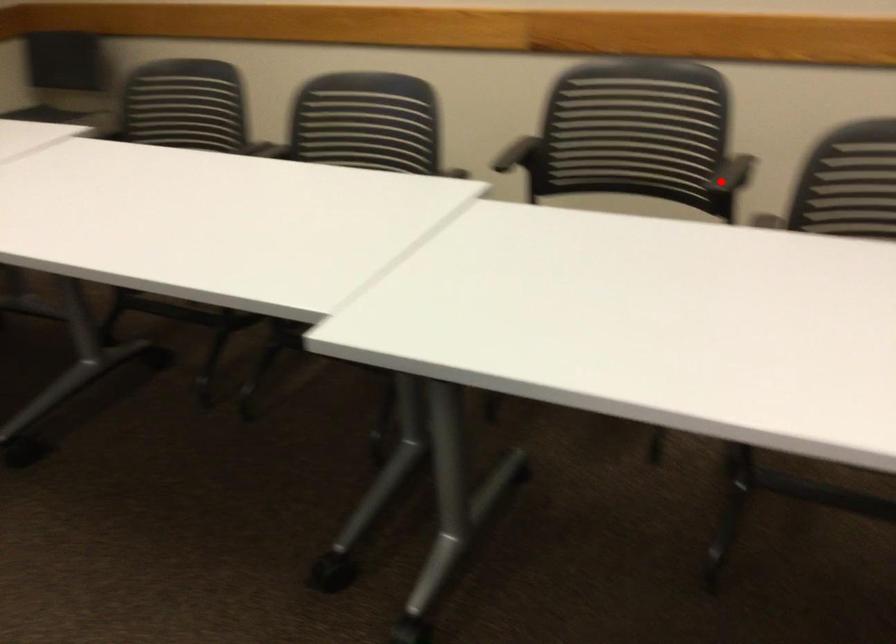
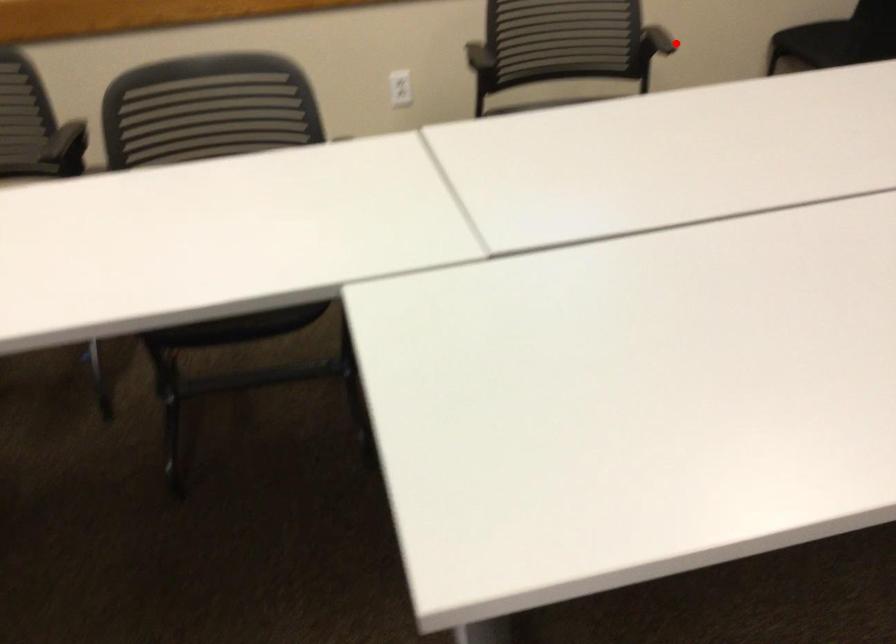
I am providing you with two images of the same scene from different viewpoints. A red point is marked on the first image and another point is marked on the second image. Do the highlighted points in image1 and image2 indicate the same real-world spot?

No